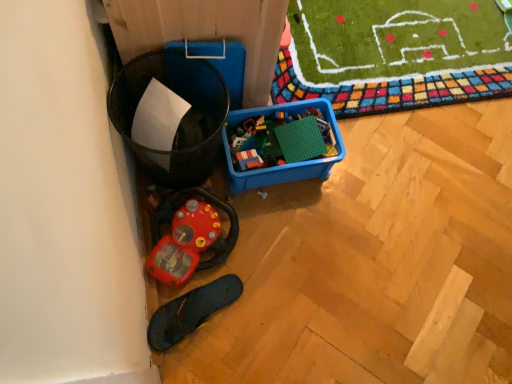
Question: From their relative heights in the image, would you say black rubber slipper at lower left is taller or shorter than green matte building blocks at center, which is the first toy in top-to-bottom order?

Choices:
 (A) tall
 (B) short

Answer: (A)

Question: Considering the positions of black rubber slipper at lower left and green matte building blocks at center, which ranks as the 2th toy in left-to-right order, in the image, is black rubber slipper at lower left wider or thinner than green matte building blocks at center, which ranks as the 2th toy in left-to-right order,?

Choices:
 (A) wide
 (B) thin

Answer: (A)

Question: Which is farther from the green matte building blocks at center, acting as the 1th toy starting from the right?

Choices:
 (A) black rubber slipper at lower left
 (B) rubberized plastic toy at lower left, which is the 2th toy from right to left

Answer: (A)

Question: Which object is the farthest from the black rubber slipper at lower left?

Choices:
 (A) green matte building blocks at center, which ranks as the 2th toy in left-to-right order
 (B) rubberized plastic toy at lower left, which ranks as the second toy in top-to-bottom order

Answer: (A)